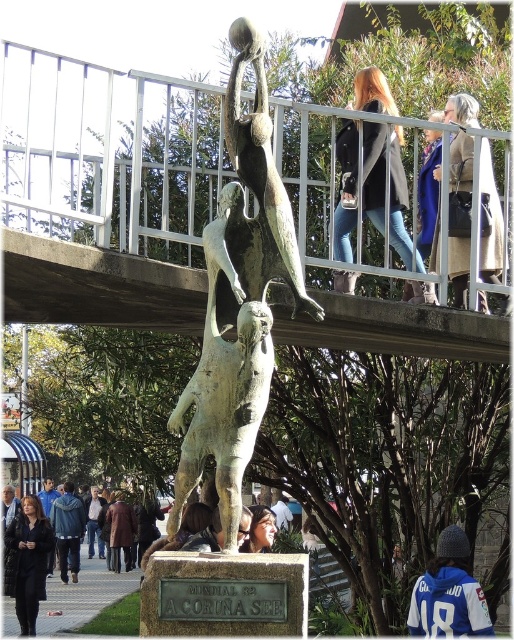
Question: Which point is closer to the camera taking this photo?

Choices:
 (A) (74, 560)
 (B) (87, 513)
 (C) (17, 556)
 (D) (286, 516)

Answer: (D)

Question: Which of the following is the closest to the observer?

Choices:
 (A) (448, 112)
 (B) (115, 515)
 (C) (284, 515)

Answer: (A)

Question: Does bronze statue at center have a lesser width compared to brown leather jacket at lower left?

Choices:
 (A) yes
 (B) no

Answer: (B)

Question: From the image, what is the correct spatial relationship of jeans at center in relation to dark brown leather jacket at lower left?

Choices:
 (A) below
 (B) above

Answer: (B)

Question: Which object is farther from the camera taking this photo?

Choices:
 (A) black fabric coat at lower left
 (B) denim jacket at upper center
 (C) dark brown leather jacket at lower left

Answer: (C)

Question: Can you confirm if blue fabric coat at upper right is bigger than white cotton shirt at lower center?

Choices:
 (A) no
 (B) yes

Answer: (B)